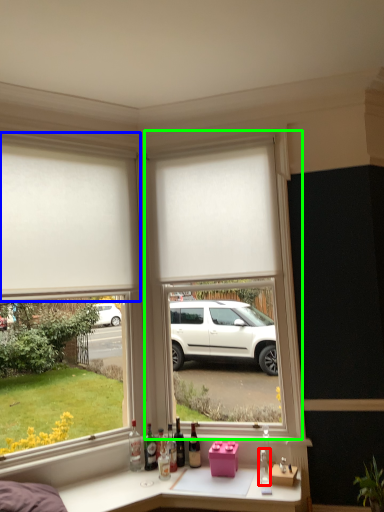
Question: Based on their relative distances, which object is nearer to bottle (highlighted by a red box)? Choose from window (highlighted by a blue box) and window frame (highlighted by a green box).

Choices:
 (A) window
 (B) window frame

Answer: (B)